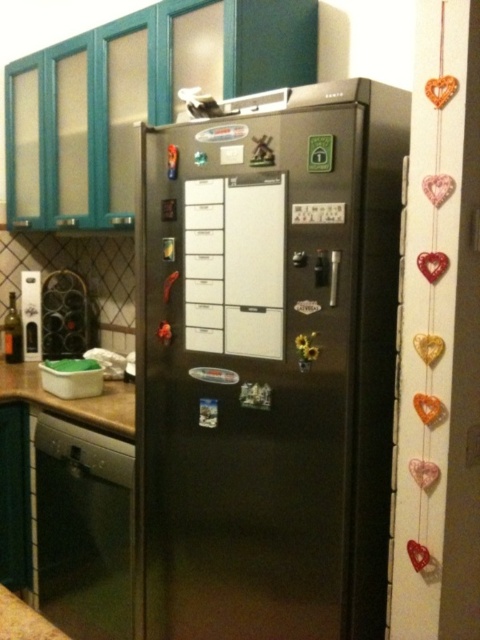
You are a kitchen designer planning to install a new appliance. You see the satin black dishwasher at lower left and the brown wood countertop at lower left. Which one is located lower in the kitchen?

The satin black dishwasher at lower left is located lower than the brown wood countertop at lower left, so it is the lower one.

You are organizing a kitchen layout and need to place a new appliance that requires 1.2 meters of width. You see the satin black refrigerator at center and the brown wood countertop at lower left. Which object can accommodate the appliance based on their widths?

The brown wood countertop at lower left has a greater width than the satin black refrigerator at center, so it can accommodate the appliance requiring 1.2 meters of width.

You are organizing the kitchen and want to place a heavy appliance on the brown wood countertop at lower left. However, you notice the satin black refrigerator at center is already positioned above it. Is there enough space between the refrigerator and the countertop to safely place the appliance on the countertop?

The satin black refrigerator at center is above the brown wood countertop at lower left, so placing a heavy appliance on the countertop may not be safe due to the refrigerator occupying the space above it.